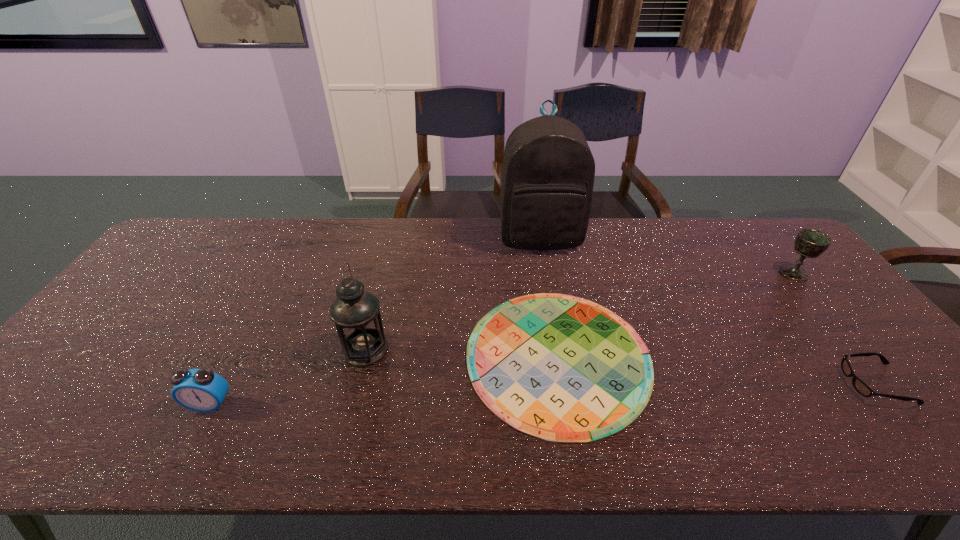
Locate an element on the screen. free spot that satisfies the following two spatial constraints: 1. on the front-facing side of the spectacles; 2. on the face of the alarm clock is located at coordinates (892, 404).